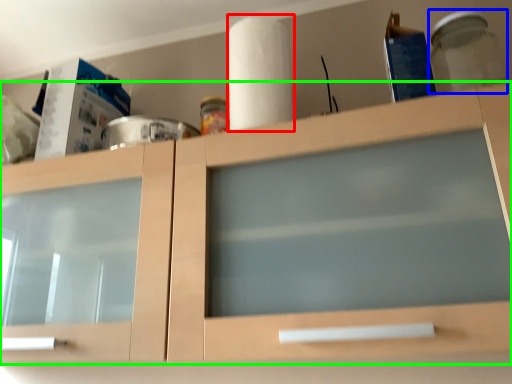
Question: Which object is positioned farthest from paper towel (highlighted by a red box)? Select from glass jar (highlighted by a blue box) and cabinetry (highlighted by a green box).

Choices:
 (A) glass jar
 (B) cabinetry

Answer: (A)